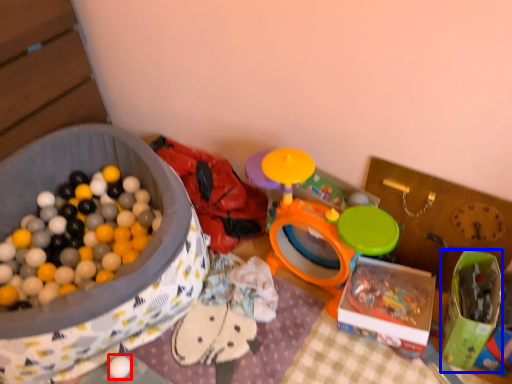
Question: Which object appears farthest to the camera in this image, toy (highlighted by a red box) or box (highlighted by a blue box)?

Choices:
 (A) toy
 (B) box

Answer: (A)